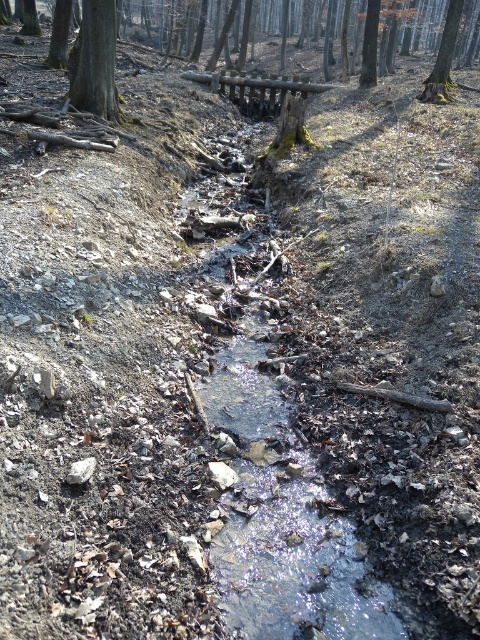
Measure the distance between smooth brown tree trunk at upper left and camera.

9.12 meters

Does smooth brown tree trunk at upper left have a lesser height compared to green mossy tree at upper center?

Indeed, smooth brown tree trunk at upper left has a lesser height compared to green mossy tree at upper center.

Find the location of `smooth brown tree trunk at upper left`. smooth brown tree trunk at upper left is located at coordinates (95, 60).